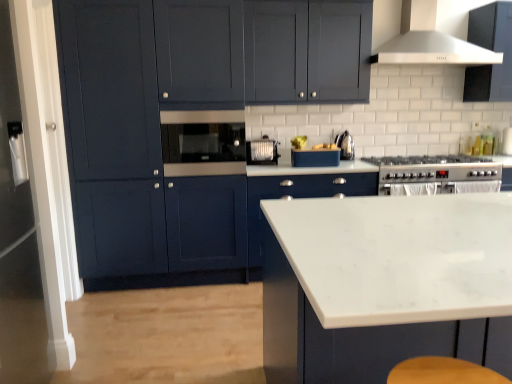
The image size is (512, 384). Find the location of `silver metallic gas stove at center right`. silver metallic gas stove at center right is located at coordinates (435, 168).

At what (x,y) coordinates should I click in order to perform the action: click on white matte range hood at upper center. Please return your answer as a coordinate pair (x, y). Looking at the image, I should click on (429, 41).

Describe the element at coordinates (307, 51) in the screenshot. Image resolution: width=512 pixels, height=384 pixels. I see `matte dark blue cabinet at upper center, the second cabinetry when ordered from back to front` at that location.

The height and width of the screenshot is (384, 512). What do you see at coordinates (385, 285) in the screenshot?
I see `white marble countertop at center, the 4th cabinetry from the back` at bounding box center [385, 285].

Find the location of a particular element. The image size is (512, 384). white marble countertop at center, the 4th cabinetry from the back is located at coordinates (385, 285).

Describe the element at coordinates (297, 197) in the screenshot. I see `white glossy cabinet at center, the first cabinetry from the back` at that location.

Where is `matte dark blue cabinets at left, positioned as the 3th cabinetry in back-to-front order`? matte dark blue cabinets at left, positioned as the 3th cabinetry in back-to-front order is located at coordinates (191, 124).

This screenshot has height=384, width=512. Find the location of `silver metallic gas stove at center right`. silver metallic gas stove at center right is located at coordinates (435, 168).

Could you measure the distance between polished stainless steel kettle at right and white plastic toaster at center, which is counted as the first appliance, starting from the left?

polished stainless steel kettle at right and white plastic toaster at center, which is counted as the first appliance, starting from the left, are 23.71 inches apart.

Is polished stainless steel kettle at right further to the viewer compared to white plastic toaster at center, the 2th appliance positioned from the right?

Yes, it is behind white plastic toaster at center, the 2th appliance positioned from the right.

Does point (353, 143) come farther from viewer compared to point (270, 139)?

Yes, it is behind point (270, 139).

This screenshot has height=384, width=512. In order to click on kitchen appliance that appears above the white plastic toaster at center, which is counted as the first appliance, starting from the left (from the image's perspective) in this screenshot , I will do `click(346, 146)`.

In the image, is white plastic toaster at center, the 2th appliance positioned from the right, on the left side or the right side of silver metallic gas stove at center right?

white plastic toaster at center, the 2th appliance positioned from the right, is to the left of silver metallic gas stove at center right.

From the image's perspective, between white plastic toaster at center, the 2th appliance positioned from the right, and silver metallic gas stove at center right, who is located below?

From the image's view, silver metallic gas stove at center right is below.

Where is `gas stove located in front of the white plastic toaster at center, which is counted as the first appliance, starting from the left`? gas stove located in front of the white plastic toaster at center, which is counted as the first appliance, starting from the left is located at coordinates (435, 168).

From the image's perspective, is matte black microwave at center positioned above or below polished stainless steel kettle at right?

matte black microwave at center is below polished stainless steel kettle at right.

In terms of height, does matte black microwave at center look taller or shorter compared to polished stainless steel kettle at right?

Clearly, matte black microwave at center is taller compared to polished stainless steel kettle at right.

From a real-world perspective, between matte black microwave at center and polished stainless steel kettle at right, who is vertically lower?

polished stainless steel kettle at right, from a real-world perspective.

Which object is closer to the camera taking this photo, matte black microwave at center or polished stainless steel kettle at right?

matte black microwave at center is closer to the camera.

Considering the relative positions of white marble countertop at center, the 4th cabinetry from the back, and white plastic toaster at center, the 2th appliance positioned from the right, in the image provided, is white marble countertop at center, the 4th cabinetry from the back, to the left or to the right of white plastic toaster at center, the 2th appliance positioned from the right,?

white marble countertop at center, the 4th cabinetry from the back, is to the right of white plastic toaster at center, the 2th appliance positioned from the right.

Can you confirm if white marble countertop at center, marked as the 1th cabinetry in a front-to-back arrangement, is shorter than white plastic toaster at center, the 2th appliance positioned from the right?

Incorrect, the height of white marble countertop at center, marked as the 1th cabinetry in a front-to-back arrangement, does not fall short of that of white plastic toaster at center, the 2th appliance positioned from the right.

From the image's perspective, count 2nd cabinetrys downward from the white plastic toaster at center, the 2th appliance positioned from the right, and point to it. Please provide its 2D coordinates.

[(385, 285)]

Is matte dark blue cabinets at left, acting as the second cabinetry starting from the front, not close to white matte range hood at upper center?

That's right, there is a large distance between matte dark blue cabinets at left, acting as the second cabinetry starting from the front, and white matte range hood at upper center.

Considering the relative sizes of matte dark blue cabinets at left, acting as the second cabinetry starting from the front, and white matte range hood at upper center in the image provided, is matte dark blue cabinets at left, acting as the second cabinetry starting from the front, taller than white matte range hood at upper center?

Correct, matte dark blue cabinets at left, acting as the second cabinetry starting from the front, is much taller as white matte range hood at upper center.

How many degrees apart are the facing directions of matte dark blue cabinets at left, positioned as the 3th cabinetry in back-to-front order, and white matte range hood at upper center?

There is a 0.0349-degree angle between the facing directions of matte dark blue cabinets at left, positioned as the 3th cabinetry in back-to-front order, and white matte range hood at upper center.

Is matte dark blue cabinets at left, positioned as the 3th cabinetry in back-to-front order, facing towards white matte range hood at upper center?

No, matte dark blue cabinets at left, positioned as the 3th cabinetry in back-to-front order, is not oriented towards white matte range hood at upper center.

Is white glossy cabinet at center, the first cabinetry from the back, taller than white matte range hood at upper center?

Yes.

In the scene shown: What's the angular difference between white glossy cabinet at center, which is counted as the fourth cabinetry, starting from the front, and white matte range hood at upper center's facing directions?

0.162 degrees.

Does point (267, 196) appear closer or farther from the camera than point (433, 62)?

Point (267, 196) appears to be closer to the viewer than point (433, 62).

Is white glossy cabinet at center, the first cabinetry from the back, thinner than white matte range hood at upper center?

Incorrect, the width of white glossy cabinet at center, the first cabinetry from the back, is not less than that of white matte range hood at upper center.

This screenshot has width=512, height=384. I want to click on the 1st cabinetry directly beneath the matte blue toaster at center, the 2th appliance viewed from the left (from a real-world perspective), so 385,285.

From a real-world perspective, relative to matte blue toaster at center, the 2th appliance viewed from the left, is white marble countertop at center, the 4th cabinetry from the back, vertically above or below?

Clearly, from a real-world perspective, white marble countertop at center, the 4th cabinetry from the back, is below matte blue toaster at center, the 2th appliance viewed from the left.

Can you confirm if white marble countertop at center, the 4th cabinetry from the back, is smaller than matte blue toaster at center, the 2th appliance viewed from the left?

No, white marble countertop at center, the 4th cabinetry from the back, is not smaller than matte blue toaster at center, the 2th appliance viewed from the left.

Which point is more distant from viewer, (x=338, y=271) or (x=298, y=158)?

Point (x=298, y=158)

This screenshot has width=512, height=384. I want to click on the 2nd appliance counting from the left side of the polished stainless steel kettle at right, so click(x=262, y=151).

Where is `gas stove below the white plastic toaster at center, the 2th appliance positioned from the right (from the image's perspective)`? The image size is (512, 384). gas stove below the white plastic toaster at center, the 2th appliance positioned from the right (from the image's perspective) is located at coordinates (435, 168).

Estimate the real-world distances between objects in this image. Which object is closer to polished stainless steel kettle at right, white glossy cabinet at center, the first cabinetry from the back, or matte black microwave at center?

white glossy cabinet at center, the first cabinetry from the back, lies closer to polished stainless steel kettle at right than the other object.

Based on their spatial positions, is white marble countertop at center, marked as the 1th cabinetry in a front-to-back arrangement, or polished stainless steel kettle at right further from matte dark blue cabinet at upper center, placed as the 3th cabinetry when sorted from front to back?

Based on the image, white marble countertop at center, marked as the 1th cabinetry in a front-to-back arrangement, appears to be further to matte dark blue cabinet at upper center, placed as the 3th cabinetry when sorted from front to back.

Based on their spatial positions, is silver metallic gas stove at center right or matte black microwave at center further from white matte range hood at upper center?

The object further to white matte range hood at upper center is matte black microwave at center.

When comparing their distances from polished stainless steel kettle at right, does white plastic toaster at center, the 2th appliance positioned from the right, or matte dark blue cabinets at left, positioned as the 3th cabinetry in back-to-front order, seem closer?

white plastic toaster at center, the 2th appliance positioned from the right, lies closer to polished stainless steel kettle at right than the other object.

From the image, which object appears to be nearer to polished stainless steel kettle at right, white glossy cabinet at center, which is counted as the fourth cabinetry, starting from the front, or matte dark blue cabinets at left, acting as the second cabinetry starting from the front?

Based on the image, white glossy cabinet at center, which is counted as the fourth cabinetry, starting from the front, appears to be nearer to polished stainless steel kettle at right.

Considering their positions, is matte dark blue cabinets at left, acting as the second cabinetry starting from the front, positioned further to white plastic toaster at center, the 2th appliance positioned from the right, than white matte range hood at upper center?

white matte range hood at upper center is positioned further to the anchor white plastic toaster at center, the 2th appliance positioned from the right.

Which object lies nearer to the anchor point matte blue toaster at center, the 2th appliance viewed from the left, white marble countertop at center, marked as the 1th cabinetry in a front-to-back arrangement, or silver metallic gas stove at center right?

silver metallic gas stove at center right is closer to matte blue toaster at center, the 2th appliance viewed from the left.

Based on their spatial positions, is white glossy cabinet at center, the first cabinetry from the back, or silver metallic gas stove at center right closer to matte black microwave at center?

white glossy cabinet at center, the first cabinetry from the back, is positioned closer to the anchor matte black microwave at center.

Identify the location of cabinetry between white marble countertop at center, the 4th cabinetry from the back, and white matte range hood at upper center, along the z-axis. The width and height of the screenshot is (512, 384). (191, 124).

Locate an element on the screen. kitchen appliance between white matte range hood at upper center and silver metallic gas stove at center right vertically is located at coordinates (346, 146).

At what (x,y) coordinates should I click in order to perform the action: click on appliance between matte dark blue cabinet at upper center, placed as the 3th cabinetry when sorted from front to back, and silver metallic gas stove at center right. Please return your answer as a coordinate pair (x, y). This screenshot has width=512, height=384. Looking at the image, I should click on (315, 158).

At what (x,y) coordinates should I click in order to perform the action: click on appliance between matte black microwave at center and matte blue toaster at center, acting as the 1th appliance starting from the right, in the horizontal direction. Please return your answer as a coordinate pair (x, y). Looking at the image, I should click on (262, 151).